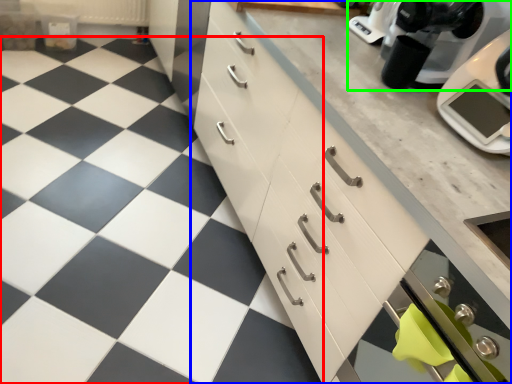
Question: Based on their relative distances, which object is nearer to tile (highlighted by a red box)? Choose from cabinetry (highlighted by a blue box) and kitchen appliance (highlighted by a green box).

Choices:
 (A) cabinetry
 (B) kitchen appliance

Answer: (A)